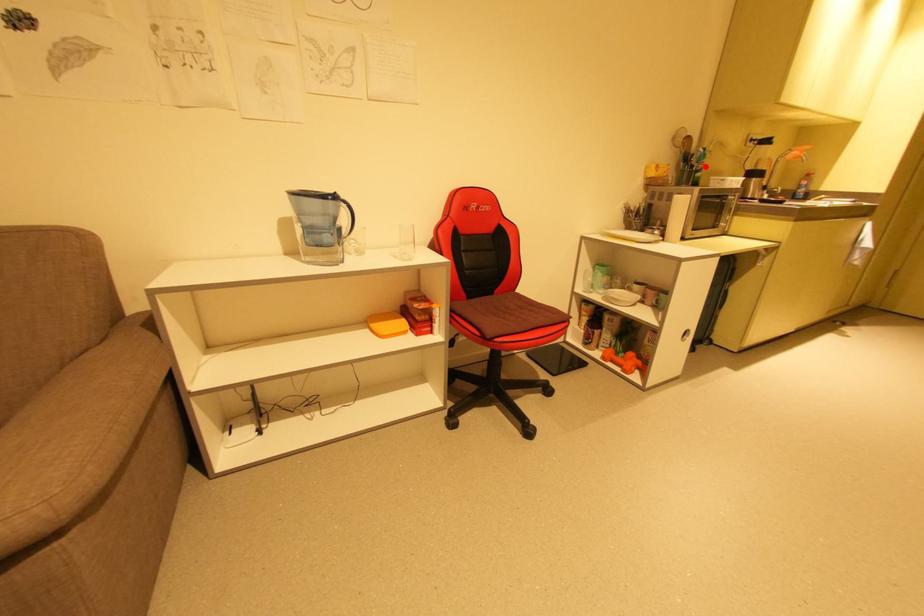
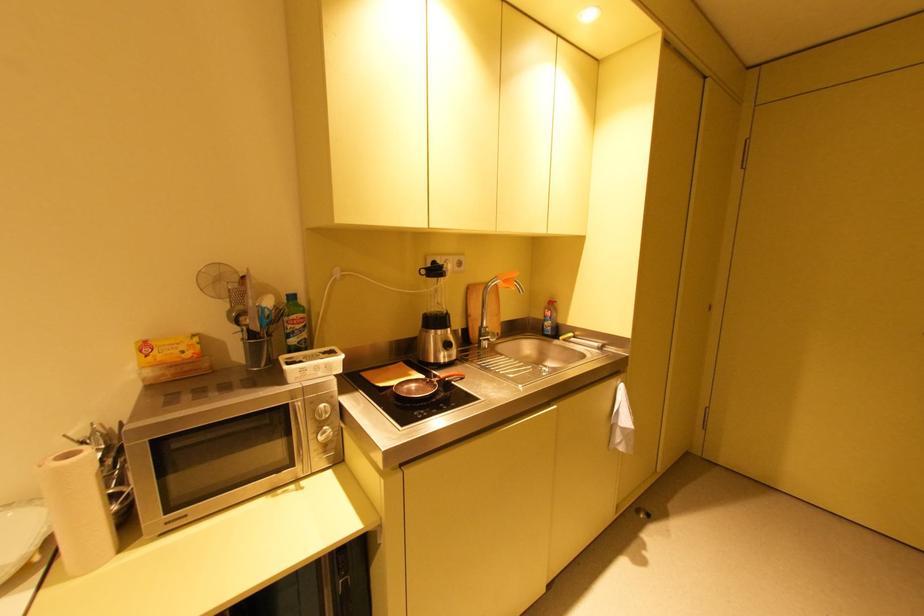
Find the pixel in the second image that matches the highlighted location in the first image.

(296, 326)